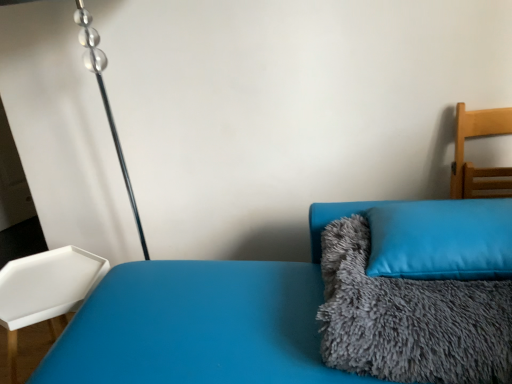
Question: From the image's perspective, is blue soft cushion at right above or below blue fuzzy couch at center?

Choices:
 (A) below
 (B) above

Answer: (B)

Question: From a real-world perspective, is blue soft cushion at right positioned above or below blue fuzzy couch at center?

Choices:
 (A) above
 (B) below

Answer: (A)

Question: Estimate the real-world distances between objects in this image. Which object is closer to the white plastic tray at left, arranged as the second furniture when viewed from the top?

Choices:
 (A) light wood chair at right, arranged as the 2th furniture when viewed from the left
 (B) blue soft cushion at right
 (C) gray fluffy blanket at right
 (D) blue fuzzy couch at center

Answer: (D)

Question: Estimate the real-world distances between objects in this image. Which object is farther from the light wood chair at right, arranged as the 1th furniture when viewed from the top?

Choices:
 (A) blue fuzzy couch at center
 (B) blue soft cushion at right
 (C) gray fluffy blanket at right
 (D) white plastic tray at left, the 1th furniture when ordered from bottom to top

Answer: (D)